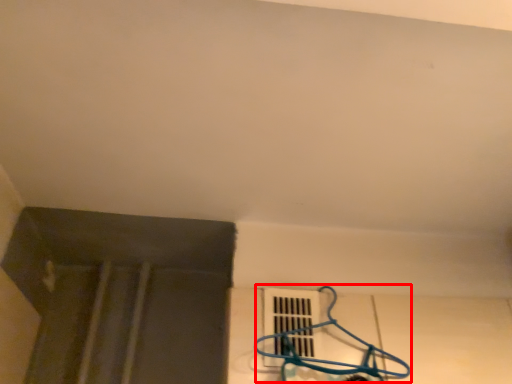
Question: From the image's perspective, where is hanger (annotated by the red box) located relative to window?

Choices:
 (A) above
 (B) below

Answer: (A)